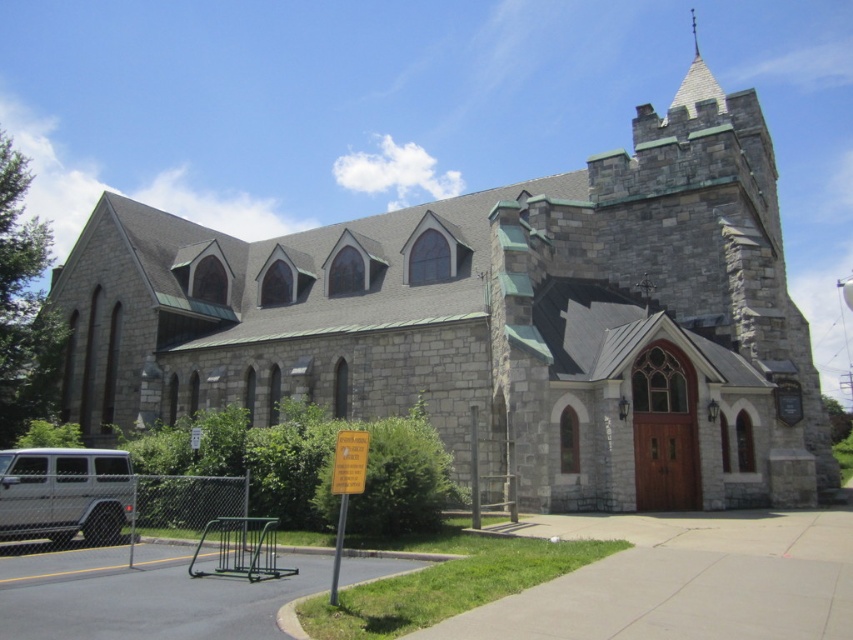
Question: Among these objects, which one is nearest to the camera?

Choices:
 (A) silver metallic van at lower left
 (B) gray stone spire at upper center

Answer: (A)

Question: Is silver metallic van at lower left to the left of gray stone spire at upper center from the viewer's perspective?

Choices:
 (A) yes
 (B) no

Answer: (A)

Question: Can you confirm if silver metallic van at lower left is smaller than gray stone spire at upper center?

Choices:
 (A) no
 (B) yes

Answer: (B)

Question: Can you confirm if silver metallic van at lower left is positioned to the right of gray stone spire at upper center?

Choices:
 (A) yes
 (B) no

Answer: (B)